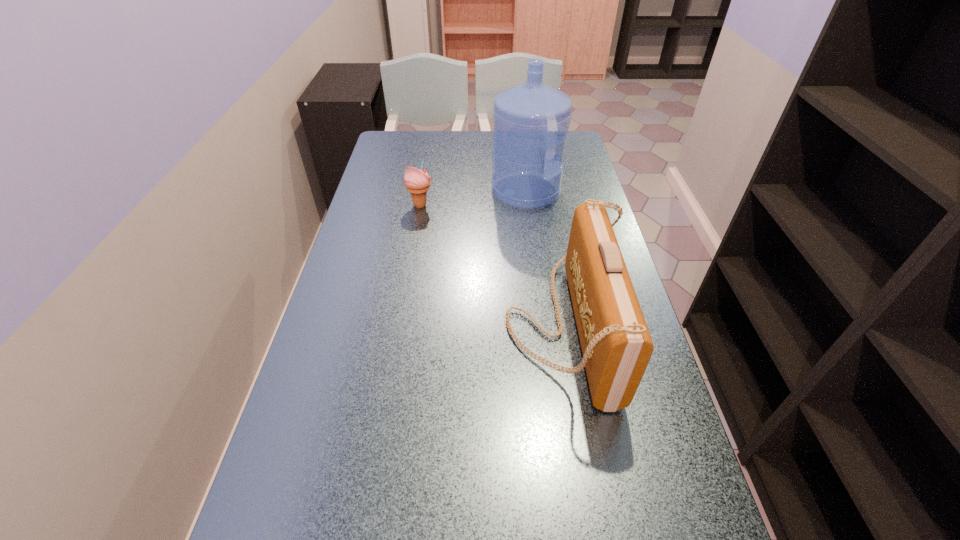
Locate an element on the screen. This screenshot has height=540, width=960. the tallest object is located at coordinates (528, 119).

The width and height of the screenshot is (960, 540). What are the coordinates of `the nearest object` in the screenshot? It's located at (616, 345).

You are a GUI agent. You are given a task and a screenshot of the screen. Output one action in this format:
    pyautogui.click(x=<x>, y=<y>)
    Task: Click on the second shortest object
    Image resolution: width=960 pixels, height=540 pixels.
    Given the screenshot: What is the action you would take?
    pyautogui.click(x=616, y=345)

This screenshot has height=540, width=960. Find the location of `icecream`. icecream is located at coordinates (417, 182).

What are the coordinates of `the shortest object` in the screenshot? It's located at (417, 182).

Find the location of a particular element. This screenshot has height=540, width=960. vacant space located on the side of the water jug with the handle is located at coordinates (578, 191).

The image size is (960, 540). I want to click on vacant space located 0.250m on the decorative side of the second shortest object, so click(401, 325).

This screenshot has height=540, width=960. In order to click on vacant space located 0.180m on the decorative side of the second shortest object in this screenshot , I will do `click(430, 325)`.

Where is `vacant space located 0.320m on the decorative side of the second shortest object`? This screenshot has height=540, width=960. vacant space located 0.320m on the decorative side of the second shortest object is located at coordinates (372, 325).

Locate an element on the screen. free space located 0.350m on the right of the shortest object is located at coordinates (543, 205).